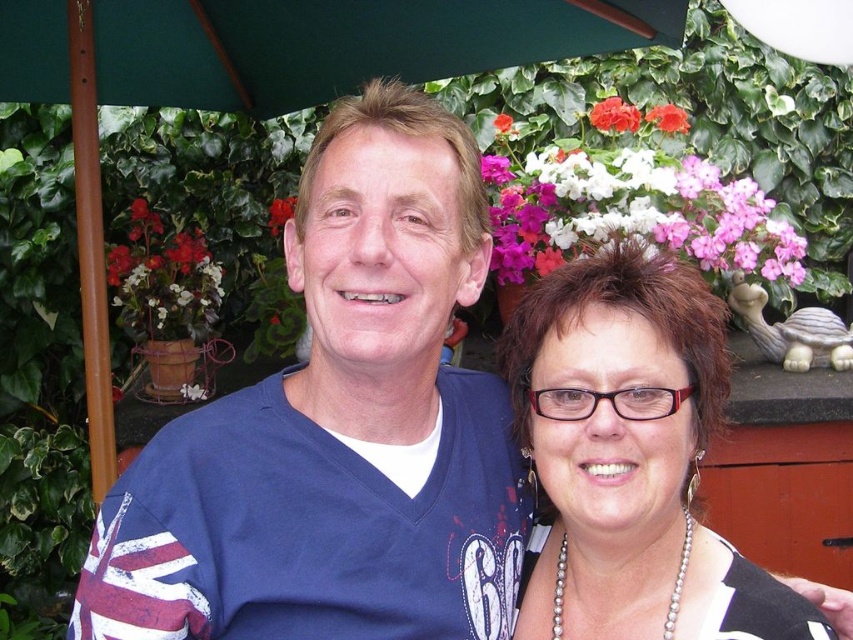
You are a photographer taking a portrait of the two people under the umbrella. You want to ensure both the pearl necklace at center and the matte white flower at upper center are visible in the frame. Which object should you focus on first to ensure both are in focus?

You should focus on the pearl necklace at center first since it is closer to the camera than the matte white flower at upper center. By focusing on the closer object, the flower will still be within the depth of field.

From the picture: You are a florist who needs to arrange these two pink matte flowers at upper center and pink matte flower at upper center in a vase. Which one should you place at the back to create a visually balanced arrangement?

To create a visually balanced arrangement, place the larger pink matte flowers at upper center at the back and the smaller pink matte flower at upper center in front since the larger one is bigger and can be seen behind the smaller one.